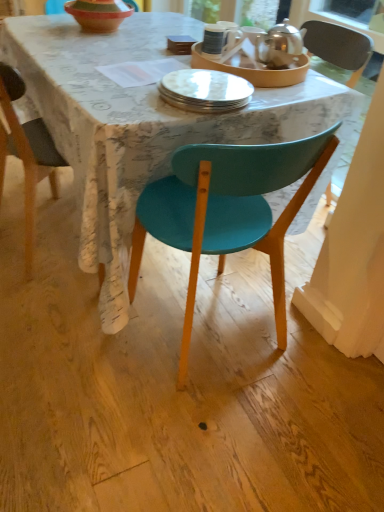
Find the location of a particular element. free area below teal plastic chair at center (from a real-world perspective) is located at coordinates (220, 340).